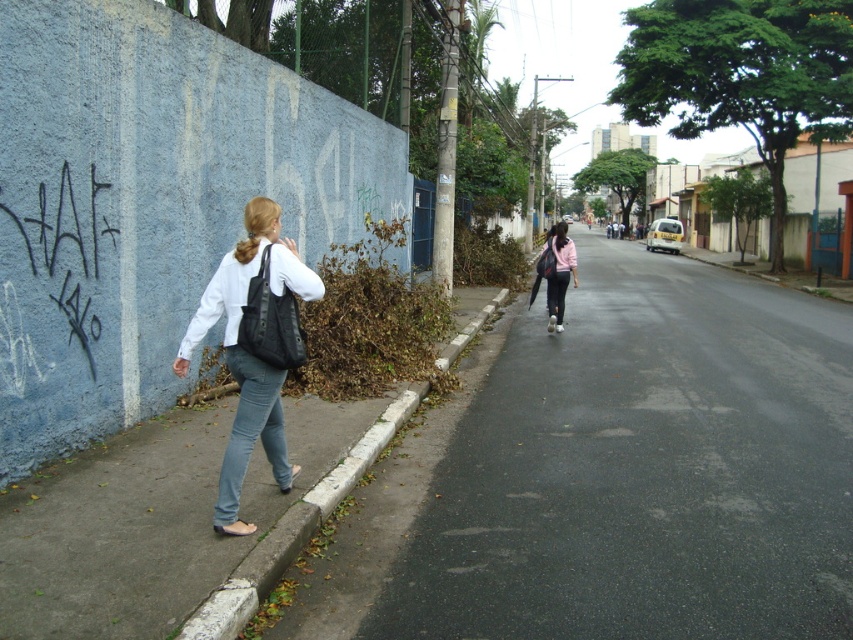
Who is lower down, matte black bag at left or pink matte jacket at center?

matte black bag at left is below.

Describe the element at coordinates (248, 355) in the screenshot. I see `matte black bag at left` at that location.

Image resolution: width=853 pixels, height=640 pixels. What are the coordinates of `matte black bag at left` in the screenshot? It's located at (248, 355).

Can you confirm if asphalt at center is taller than denim jeans at lower left?

Indeed, asphalt at center has a greater height compared to denim jeans at lower left.

Who is more forward, (653, 480) or (242, 380)?

Point (242, 380) is in front.

The width and height of the screenshot is (853, 640). What are the coordinates of `asphalt at center` in the screenshot? It's located at (614, 474).

How far apart are matte black bag at left and denim jeans at lower left?

matte black bag at left and denim jeans at lower left are 4.55 inches apart from each other.

Is matte black bag at left to the left of denim jeans at lower left from the viewer's perspective?

Yes, matte black bag at left is to the left of denim jeans at lower left.

Which is in front, point (207, 284) or point (270, 452)?

Point (270, 452)

You are a GUI agent. You are given a task and a screenshot of the screen. Output one action in this format:
    pyautogui.click(x=<x>, y=<y>)
    Task: Click on the matte black bag at left
    This screenshot has height=640, width=853.
    Given the screenshot: What is the action you would take?
    pyautogui.click(x=248, y=355)